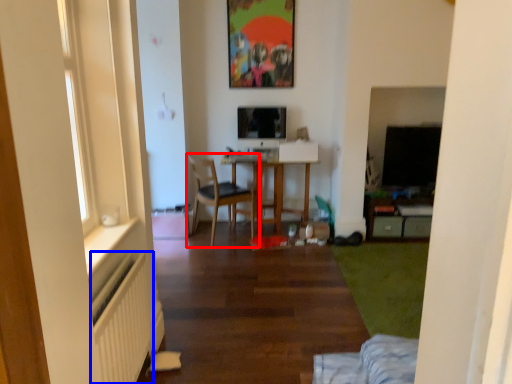
Question: Which object is further to the camera taking this photo, chair (highlighted by a red box) or radiator (highlighted by a blue box)?

Choices:
 (A) chair
 (B) radiator

Answer: (A)